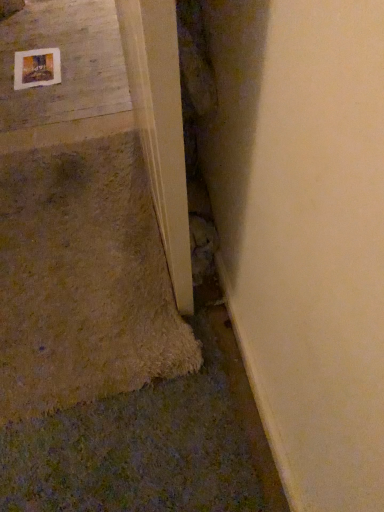
Question: Would you say wooden frame at upper left is to the left or to the right of smooth concrete at upper left in the picture?

Choices:
 (A) left
 (B) right

Answer: (A)

Question: Is wooden frame at upper left situated inside smooth concrete at upper left or outside?

Choices:
 (A) outside
 (B) inside

Answer: (B)

Question: Considering the real-world distances, which object is closest to the smooth concrete at upper left?

Choices:
 (A) wooden frame at upper left
 (B) light wood door frame at lower left

Answer: (A)

Question: Based on their relative distances, which object is farther from the light wood door frame at lower left?

Choices:
 (A) smooth concrete at upper left
 (B) wooden frame at upper left

Answer: (B)